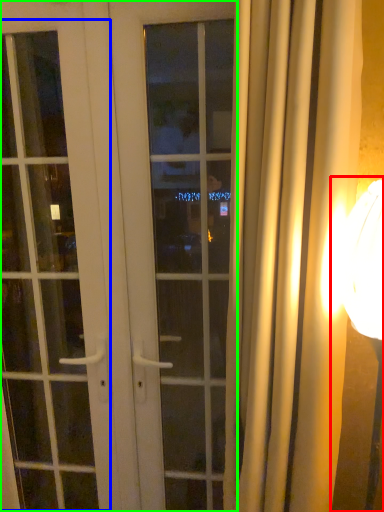
Question: Which object is the farthest from table lamp (highlighted by a red box)? Choose among these: screen door (highlighted by a blue box) or door (highlighted by a green box).

Choices:
 (A) screen door
 (B) door

Answer: (A)